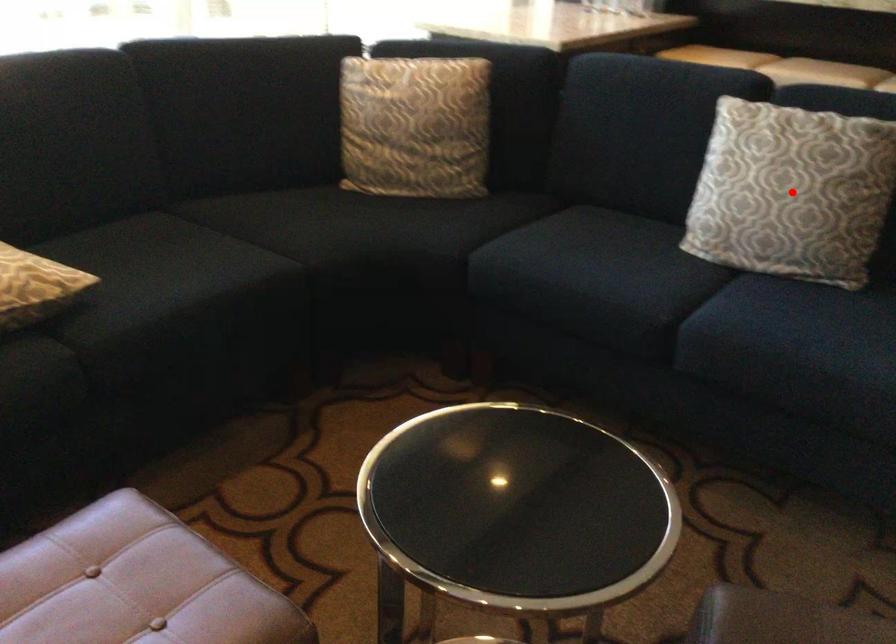
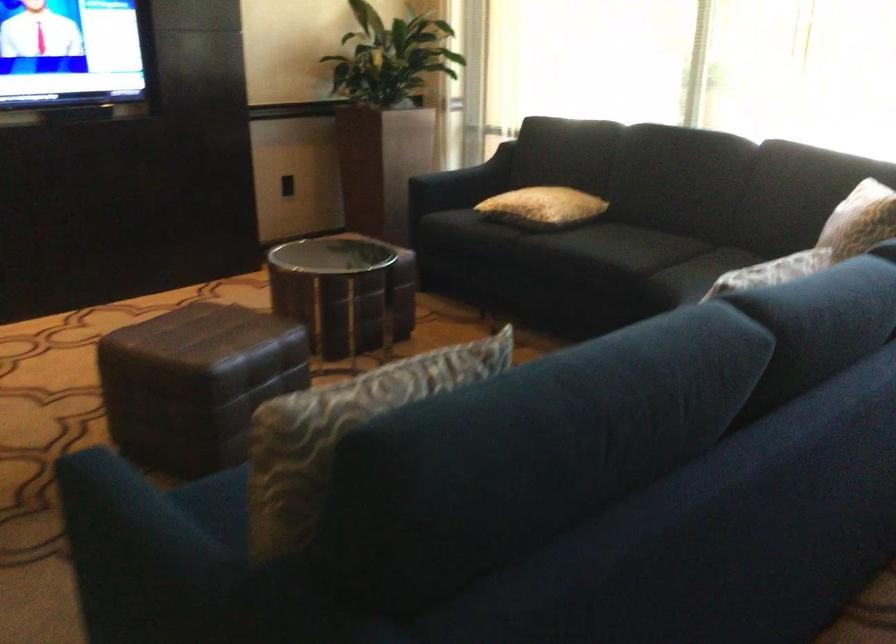
Question: I am providing you with two images of the same scene from different viewpoints. A red point is marked on the first image. Can you still see the location of the red point in image 2?

Choices:
 (A) Yes
 (B) No

Answer: (B)